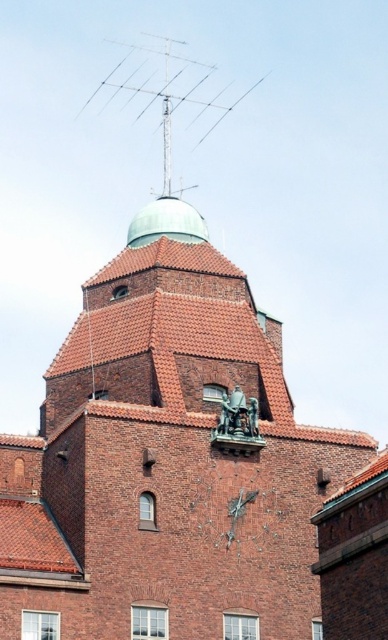
Which is in front, point (57, 563) or point (119, 84)?

Point (57, 563) is more forward.

Who is more distant from viewer, (x=60, y=563) or (x=192, y=102)?

Point (x=192, y=102)

The image size is (388, 640). I want to click on brown tiled roof at lower left, so click(x=32, y=538).